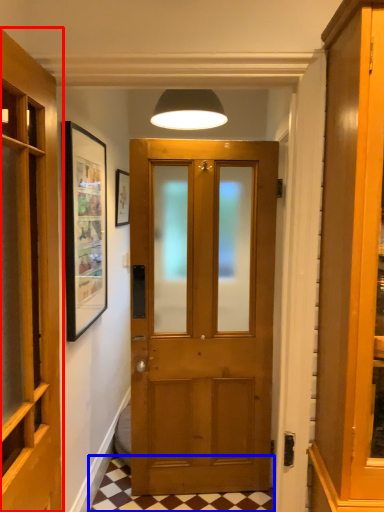
Question: Among these objects, which one is nearest to the camera, door (highlighted by a red box) or tile (highlighted by a blue box)?

Choices:
 (A) door
 (B) tile

Answer: (A)